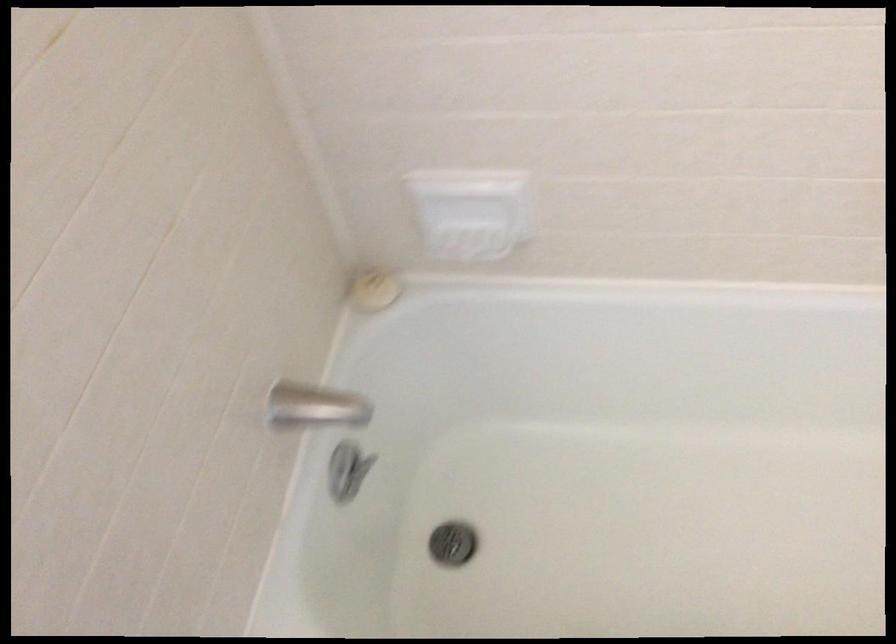
I want to click on metal faucet handle, so (314, 406).